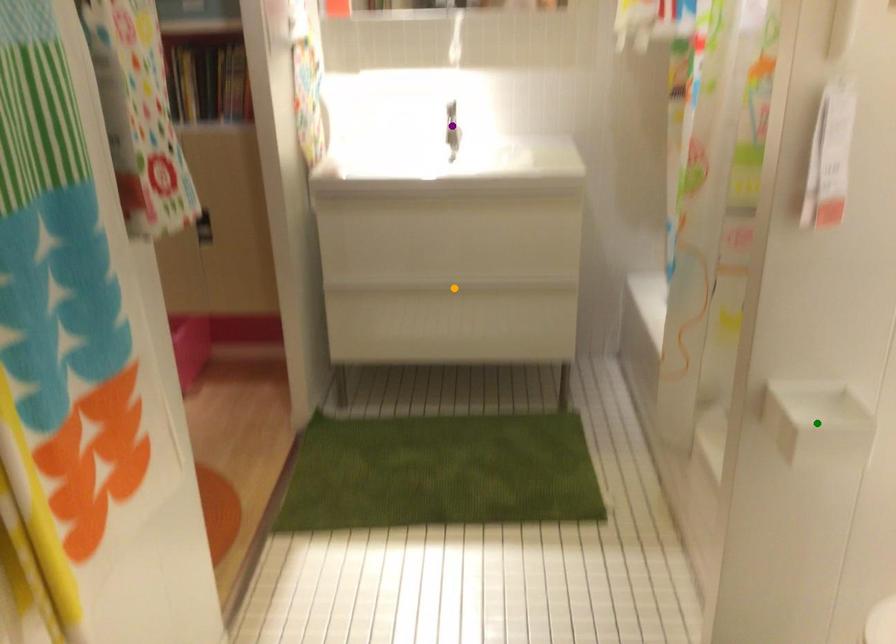
Order these from nearest to farthest:
A) green point
B) orange point
C) purple point

1. green point
2. orange point
3. purple point